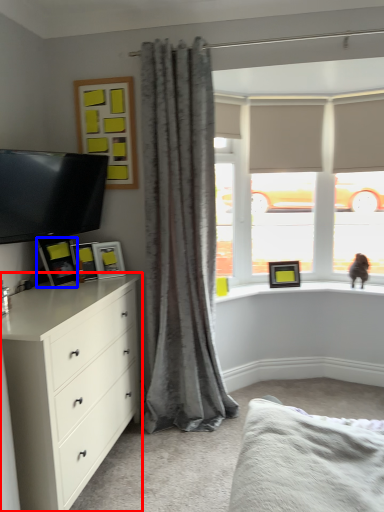
Question: Among these objects, which one is farthest to the camera, chest of drawers (highlighted by a red box) or picture frame (highlighted by a blue box)?

Choices:
 (A) chest of drawers
 (B) picture frame

Answer: (B)